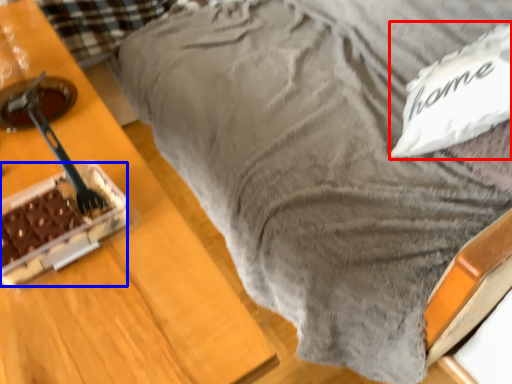
Question: Which of the following is the farthest to the observer, pillow (highlighted by a red box) or cake (highlighted by a blue box)?

Choices:
 (A) pillow
 (B) cake

Answer: (A)